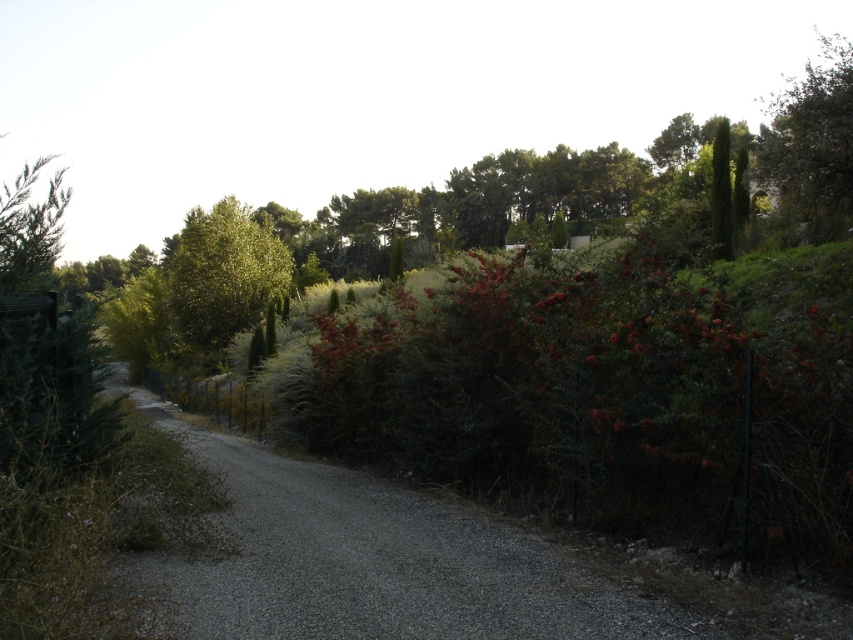
Question: Which of the following is the farthest from the observer?

Choices:
 (A) (247, 212)
 (B) (824, 205)

Answer: (A)

Question: Which of the following is the farthest from the observer?

Choices:
 (A) green leafy tree at upper right
 (B) green leafy tree at center
 (C) gray gravel road at center

Answer: (B)

Question: Is gray gravel road at center bigger than green leafy tree at center?

Choices:
 (A) no
 (B) yes

Answer: (A)

Question: Which of the following is the closest to the observer?

Choices:
 (A) green leafy tree at center
 (B) gray gravel road at center

Answer: (B)

Question: Is gray gravel road at center to the left of green leafy tree at center from the viewer's perspective?

Choices:
 (A) no
 (B) yes

Answer: (A)

Question: Does green leafy tree at upper right lie behind green leafy tree at center?

Choices:
 (A) yes
 (B) no

Answer: (B)